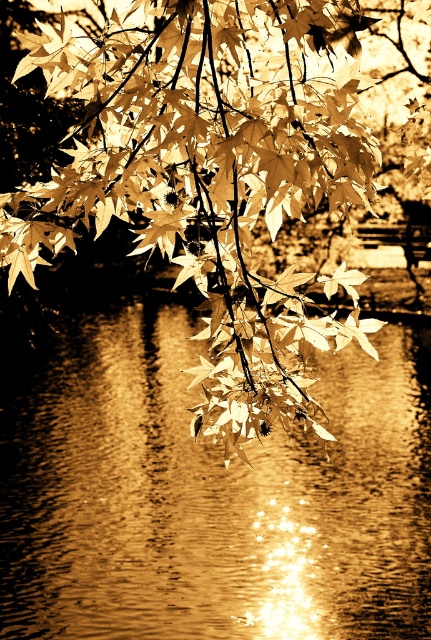
Question: Which of the following is the closest to the observer?

Choices:
 (A) sepia leafy branch at upper center
 (B) shiny reflective water at center
 (C) golden textured maple leaf at center

Answer: (A)

Question: Does sepia leafy branch at upper center appear over golden textured maple leaf at center?

Choices:
 (A) yes
 (B) no

Answer: (A)

Question: Can you confirm if shiny reflective water at center is bigger than golden textured maple leaf at center?

Choices:
 (A) yes
 (B) no

Answer: (A)

Question: Can you confirm if shiny reflective water at center is bigger than golden textured maple leaf at center?

Choices:
 (A) yes
 (B) no

Answer: (A)

Question: Among these points, which one is nearest to the camera?

Choices:
 (A) (344, 272)
 (B) (221, 356)
 (C) (274, 572)

Answer: (B)

Question: Which of the following is the farthest from the observer?

Choices:
 (A) (240, 456)
 (B) (205, 557)

Answer: (B)